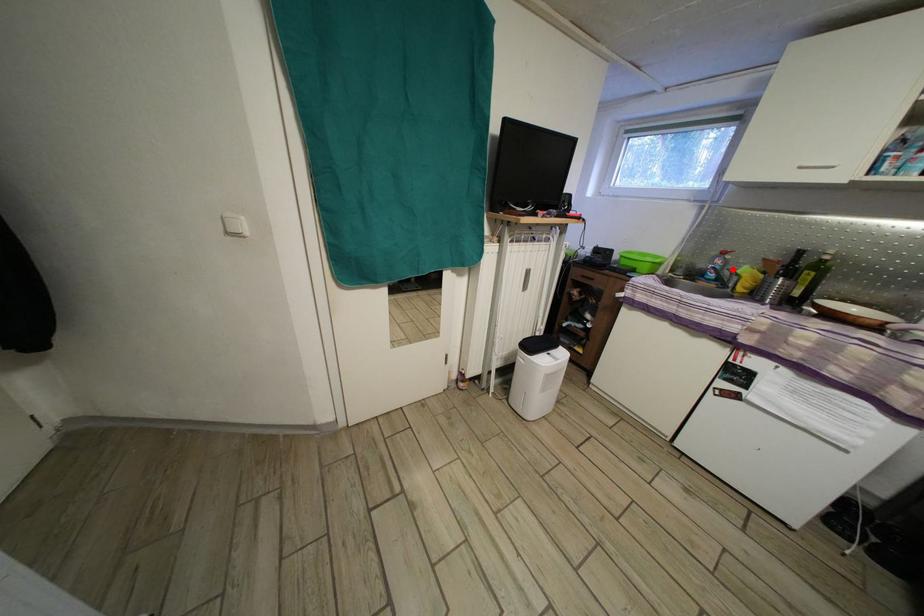
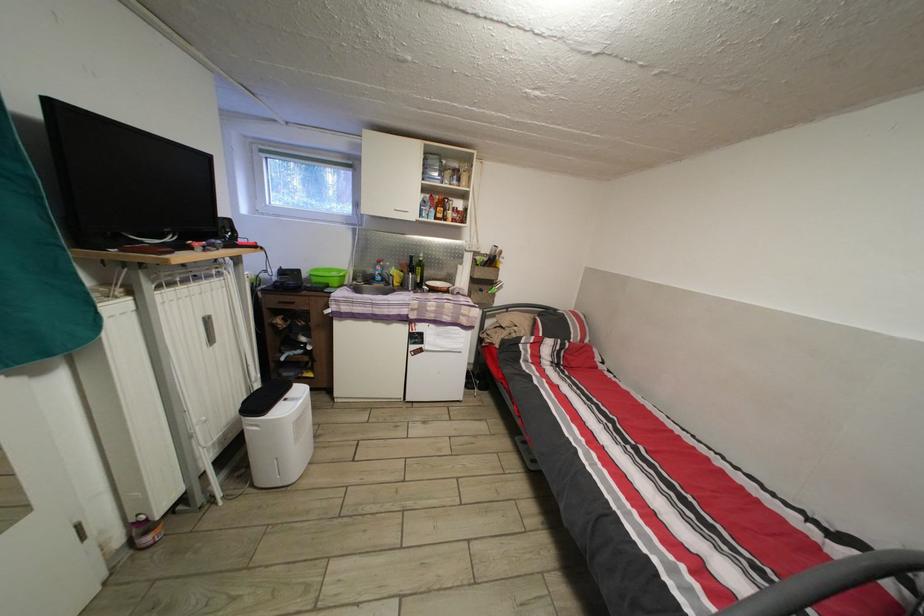
In the second image, find the point that corresponds to the highlighted location in the first image.

(390, 274)